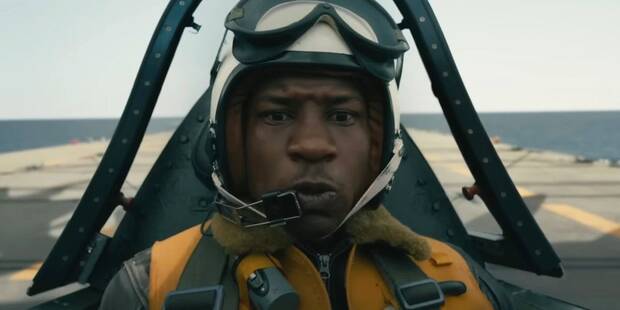
You are a GUI agent. You are given a task and a screenshot of the screen. Output one action in this format:
    pyautogui.click(x=<x>, y=<y>)
    Task: Click on the metal frame
    This screenshot has height=310, width=620.
    Given the screenshot: What is the action you would take?
    pyautogui.click(x=519, y=231), pyautogui.click(x=126, y=147)